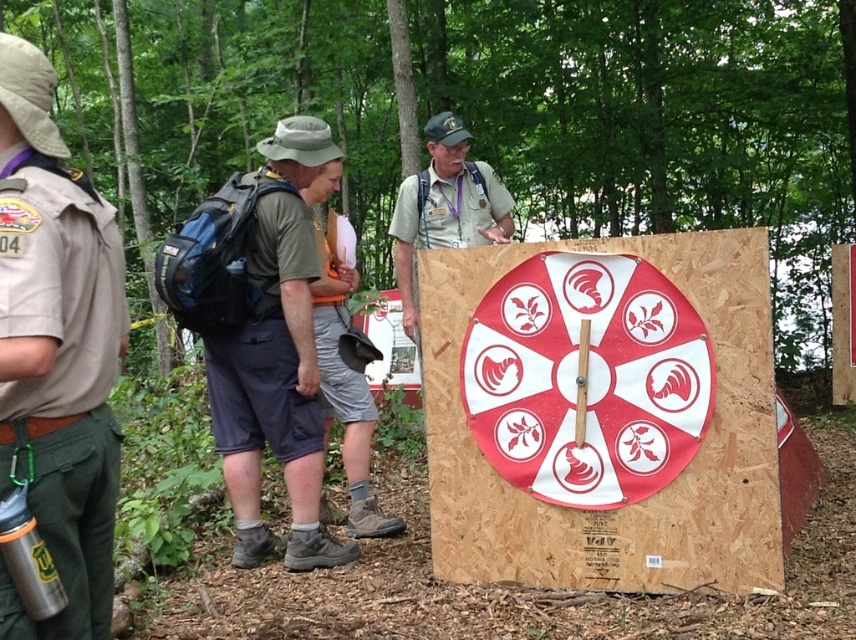
Question: Which object is positioned closest to the dark green fabric shirt at center?

Choices:
 (A) khaki uniform at center
 (B) red matte dartboard at center

Answer: (B)

Question: Does wooden dartboard at center appear over dark green fabric shirt at center?

Choices:
 (A) no
 (B) yes

Answer: (B)

Question: Considering the real-world distances, which object is closest to the dark green fabric shirt at center?

Choices:
 (A) wooden dartboard at center
 (B) khaki uniform at center
 (C) red matte dartboard at center

Answer: (C)

Question: Considering the relative positions of wooden dartboard at center and dark green fabric shirt at center in the image provided, where is wooden dartboard at center located with respect to dark green fabric shirt at center?

Choices:
 (A) below
 (B) above

Answer: (B)

Question: Estimate the real-world distances between objects in this image. Which object is farther from the wooden dartboard at center?

Choices:
 (A) dark green fabric shirt at center
 (B) khaki uniform at center

Answer: (A)

Question: Does red matte dartboard at center appear on the right side of dark green fabric shirt at center?

Choices:
 (A) no
 (B) yes

Answer: (B)